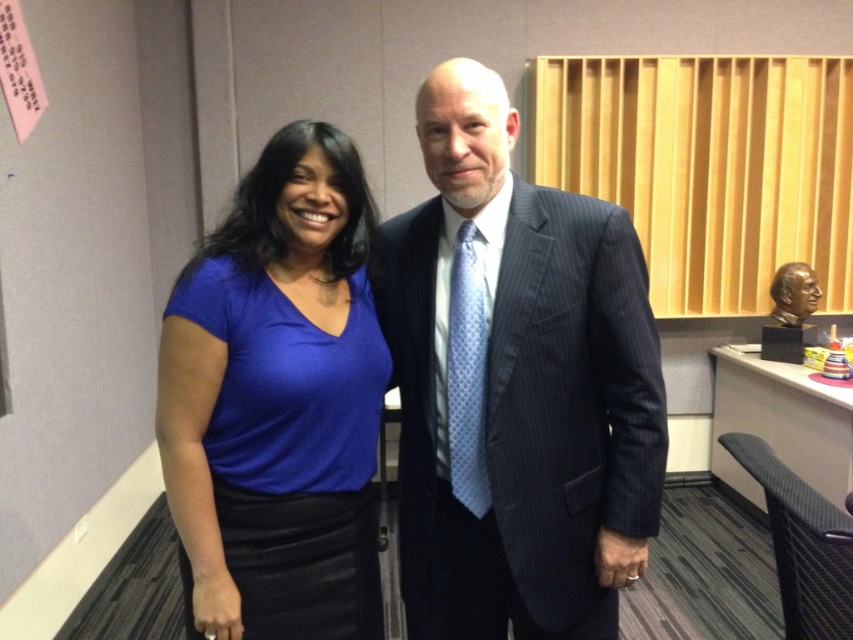
What is the coordinate of the dark blue pinstripe suit at center?

The dark blue pinstripe suit at center is located at coordinate point (515, 385).